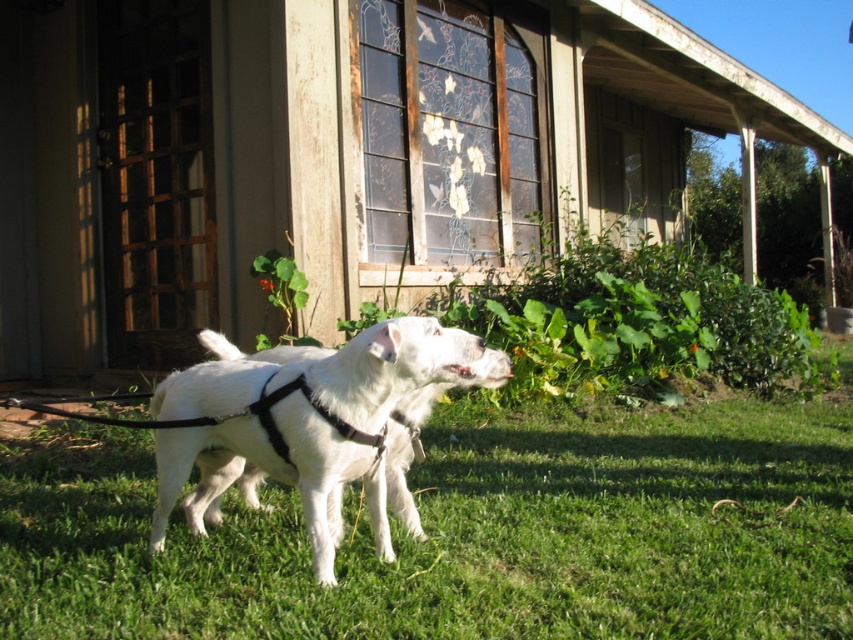
Question: Does wooden porch at center have a greater width compared to white matte harness at center?

Choices:
 (A) yes
 (B) no

Answer: (A)

Question: Observing the image, what is the correct spatial positioning of wooden porch at center in reference to green grass at lower center?

Choices:
 (A) right
 (B) left

Answer: (A)

Question: From the image, what is the correct spatial relationship of wooden porch at center in relation to green grass at lower center?

Choices:
 (A) below
 (B) above

Answer: (B)

Question: Which object is farther from the camera taking this photo?

Choices:
 (A) wooden porch at center
 (B) green grass at lower center

Answer: (A)

Question: Estimate the real-world distances between objects in this image. Which object is farther from the green grass at lower center?

Choices:
 (A) white matte harness at center
 (B) wooden porch at center

Answer: (B)

Question: Which object is farther from the camera taking this photo?

Choices:
 (A) green grass at lower center
 (B) wooden porch at center
 (C) white matte harness at center

Answer: (B)